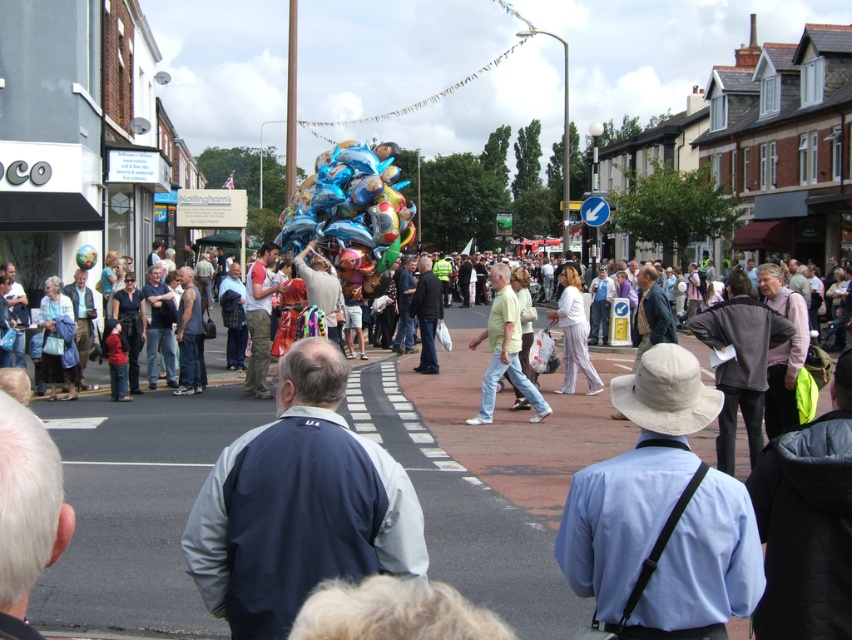
Question: Considering the real-world distances, which object is closest to the dark blue jacket at center?

Choices:
 (A) white silk pants at center
 (B) multicolored balloons at center

Answer: (B)

Question: From the image, what is the correct spatial relationship of white silk pants at center in relation to shiny metallic balloon at center?

Choices:
 (A) above
 (B) below

Answer: (B)

Question: Which is farther from the light green cotton shirt at center?

Choices:
 (A) multicolored balloons at center
 (B) light blue shirt at center
 (C) shiny metallic balloons at center
 (D) dark blue jacket at center

Answer: (C)

Question: Considering the real-world distances, which object is closest to the light blue shirt at center?

Choices:
 (A) shiny metallic balloons at center
 (B) white silk pants at center

Answer: (B)

Question: Does dark blue jacket at center have a smaller size compared to shiny metallic balloon at center?

Choices:
 (A) yes
 (B) no

Answer: (B)

Question: Can you confirm if multicolored balloons at center is wider than light blue shirt at center?

Choices:
 (A) no
 (B) yes

Answer: (B)